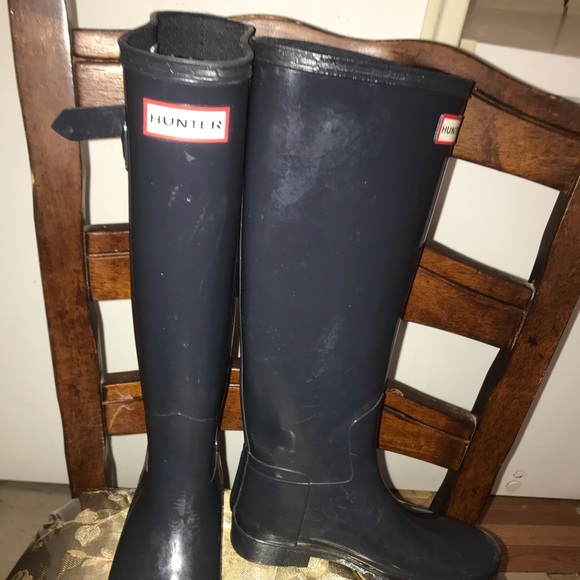
Locate an element on the screen. The width and height of the screenshot is (580, 580). white walls is located at coordinates (561, 434).